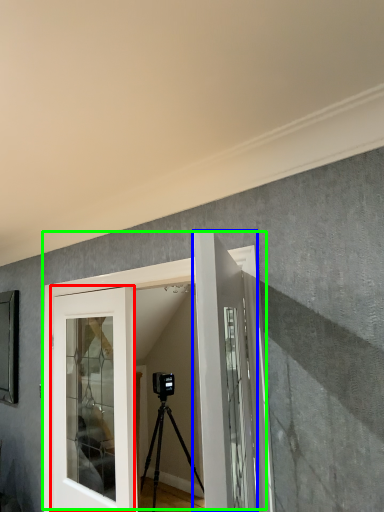
Question: Based on their relative distances, which object is nearer to door (highlighted by a red box)? Choose from door (highlighted by a blue box) and door (highlighted by a green box).

Choices:
 (A) door
 (B) door

Answer: (B)